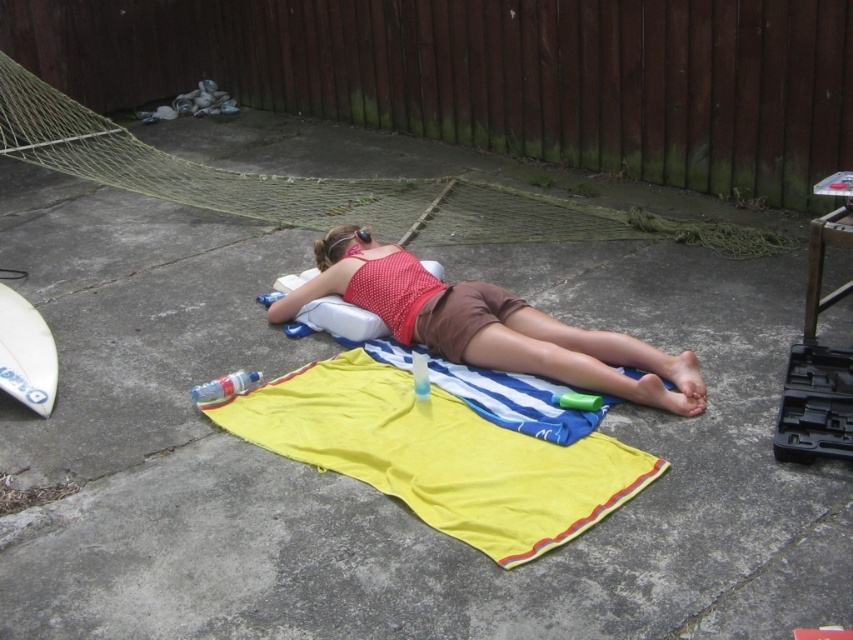
Which is below, matte red tank top at center or white matte surfboard at lower left?

white matte surfboard at lower left

Is point (665, 372) positioned behind point (25, 307)?

No, it is not.

I want to click on matte red tank top at center, so click(489, 324).

Which is behind, point (367, 397) or point (285, 314)?

Positioned behind is point (285, 314).

The height and width of the screenshot is (640, 853). What are the coordinates of `yellow fabric towel at center` in the screenshot? It's located at (438, 454).

Is yellow fabric towel at center wider than white matte surfboard at lower left?

Yes, yellow fabric towel at center is wider than white matte surfboard at lower left.

In the scene shown: Is yellow fabric towel at center in front of white matte surfboard at lower left?

Yes, it is.

Where is `yellow fabric towel at center`? This screenshot has width=853, height=640. yellow fabric towel at center is located at coordinates (438, 454).

Identify the location of yellow fabric towel at center. (438, 454).